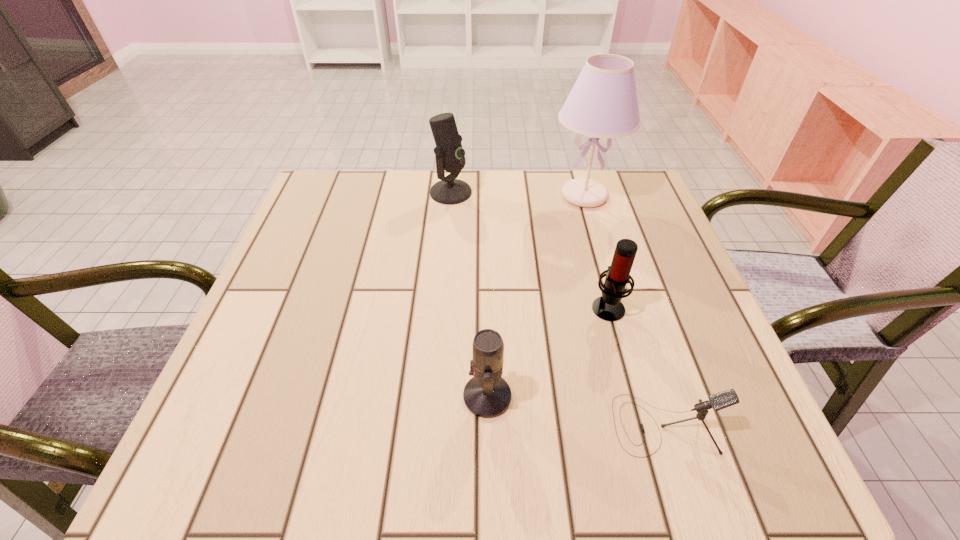
The width and height of the screenshot is (960, 540). Find the location of `microphone that can be found as the closest to the tallest microphone`. microphone that can be found as the closest to the tallest microphone is located at coordinates (608, 307).

Choose which microphone is the second nearest neighbor to the third farthest object. Please provide its 2D coordinates. Your answer should be formatted as a tuple, i.e. [(x, y)], where the tuple contains the x and y coordinates of a point satisfying the conditions above.

[(487, 395)]